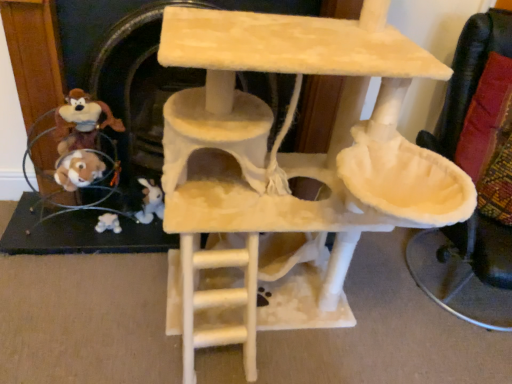
The height and width of the screenshot is (384, 512). In order to click on free space in front of white plush toy at lower left, placed as the 2th toy when sorted from top to bottom in this screenshot , I will do `click(95, 262)`.